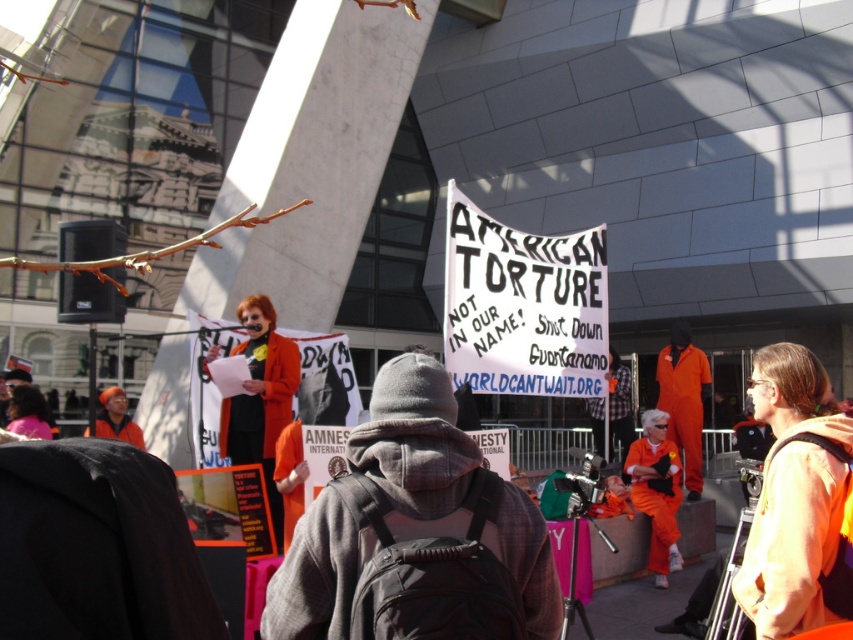
You are a photographer standing at the edge of the protest scene. You want to capture a photo that includes both the orange jumpsuit at center and the orange fabric at lower right. The camera you are using has a maximum focus range of 6 meters. Will you be able to fit both objects into the frame without moving closer?

The orange jumpsuit at center is 6.14 meters from the orange fabric at lower right. Since the distance between them exceeds the camera maximum focus range of 6 meters, you will not be able to fit both objects into the frame without moving closer.

You are a photographer at the protest scene. You want to capture a photo that includes both the orange jumpsuit at center and the orange fabric at lower right. Which object should you position closer to the bottom of the frame?

The orange fabric at lower right should be positioned closer to the bottom of the frame because it is located below the orange jumpsuit at center.